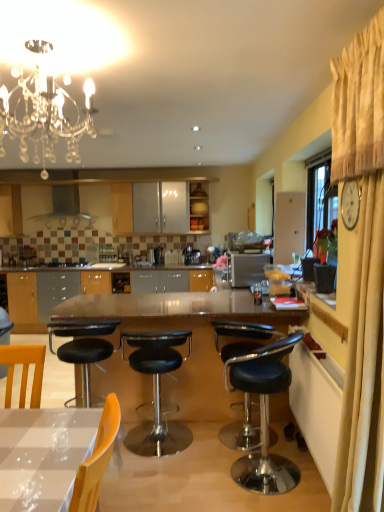
Question: Does crystal glass chandelier at upper left appear on the left side of black leather stool at center, the 2th chair positioned from the right?

Choices:
 (A) no
 (B) yes

Answer: (B)

Question: Does crystal glass chandelier at upper left touch black leather stool at center, the 2th chair positioned from the right?

Choices:
 (A) no
 (B) yes

Answer: (A)

Question: Is crystal glass chandelier at upper left completely or partially outside of black leather stool at center, the 1th chair when ordered from back to front?

Choices:
 (A) yes
 (B) no

Answer: (A)

Question: Considering the relative sizes of crystal glass chandelier at upper left and black leather stool at center, positioned as the first chair in left-to-right order, in the image provided, is crystal glass chandelier at upper left wider than black leather stool at center, positioned as the first chair in left-to-right order,?

Choices:
 (A) yes
 (B) no

Answer: (B)

Question: Is crystal glass chandelier at upper left taller than black leather stool at center, which is the second chair from front to back?

Choices:
 (A) yes
 (B) no

Answer: (B)

Question: Is crystal glass chandelier at upper left at the right side of black leather stool at center, the 2th chair positioned from the right?

Choices:
 (A) no
 (B) yes

Answer: (A)

Question: From a real-world perspective, does black leather stool at lower right, the first chair viewed from the right, stand above satin silver range hood at upper center?

Choices:
 (A) yes
 (B) no

Answer: (B)

Question: Is black leather stool at lower right, the first chair viewed from the right, at the left side of satin silver range hood at upper center?

Choices:
 (A) no
 (B) yes

Answer: (A)

Question: Is satin silver range hood at upper center surrounded by black leather stool at lower right, which is counted as the first chair, starting from the front?

Choices:
 (A) no
 (B) yes

Answer: (A)

Question: Is black leather stool at lower right, which is counted as the first chair, starting from the front, positioned beyond the bounds of satin silver range hood at upper center?

Choices:
 (A) yes
 (B) no

Answer: (A)

Question: Does black leather stool at lower right, the first chair viewed from the right, lie in front of satin silver range hood at upper center?

Choices:
 (A) no
 (B) yes

Answer: (B)

Question: From the image's perspective, is black leather stool at lower right, the second chair in the back-to-front sequence, on satin silver range hood at upper center?

Choices:
 (A) yes
 (B) no

Answer: (B)

Question: Is satin silver range hood at upper center oriented away from satin silver coffee machine at center?

Choices:
 (A) yes
 (B) no

Answer: (B)